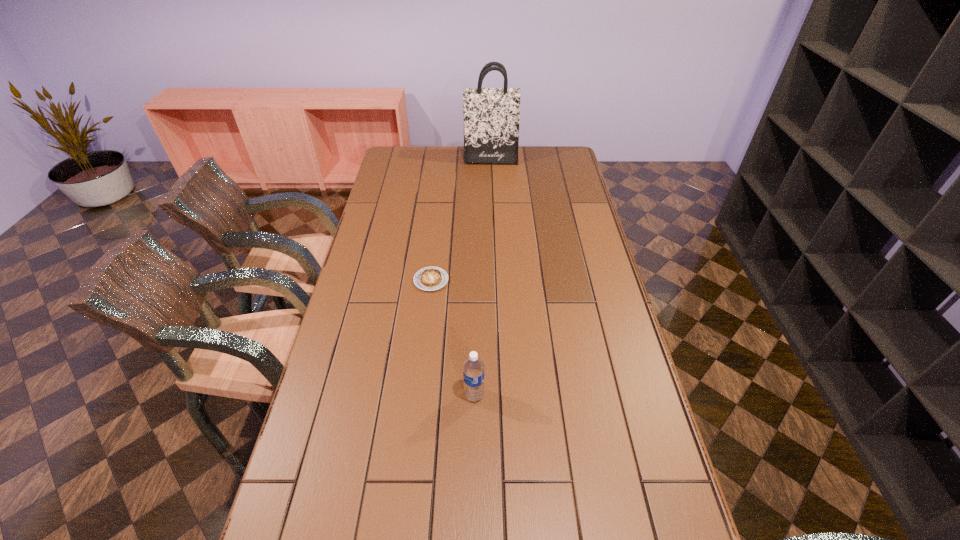
You are a GUI agent. You are given a task and a screenshot of the screen. Output one action in this format:
    pyautogui.click(x=<x>, y=<y>)
    Task: Click on the vacant space at the far edge of the desktop
    
    Given the screenshot: What is the action you would take?
    pyautogui.click(x=457, y=160)

This screenshot has width=960, height=540. I want to click on vacant space at the left edge of the desktop, so click(373, 199).

Where is `vacant space at the right edge of the desktop`? This screenshot has height=540, width=960. vacant space at the right edge of the desktop is located at coordinates (551, 178).

You are a GUI agent. You are given a task and a screenshot of the screen. Output one action in this format:
    pyautogui.click(x=<x>, y=<y>)
    Task: Click on the empty space that is in between the shopping bag and the second shortest object
    
    Given the screenshot: What is the action you would take?
    pyautogui.click(x=482, y=278)

You are a GUI agent. You are given a task and a screenshot of the screen. Output one action in this format:
    pyautogui.click(x=<x>, y=<y>)
    Task: Click on the empty location between the water bottle and the quiche
    The width and height of the screenshot is (960, 540).
    Given the screenshot: What is the action you would take?
    click(x=453, y=338)

The image size is (960, 540). In order to click on free space between the nearest object and the shortest object in this screenshot , I will do pos(453,338).

Find the location of a particular element. The width and height of the screenshot is (960, 540). free space that is in between the nearest object and the shopping bag is located at coordinates (482, 278).

Locate an element on the screen. free space between the shortest object and the nearest object is located at coordinates (453, 338).

Where is `free space between the farthest object and the nearest object`? free space between the farthest object and the nearest object is located at coordinates (482, 278).

The width and height of the screenshot is (960, 540). Find the location of `free space between the nearest object and the shopping bag`. free space between the nearest object and the shopping bag is located at coordinates (482, 278).